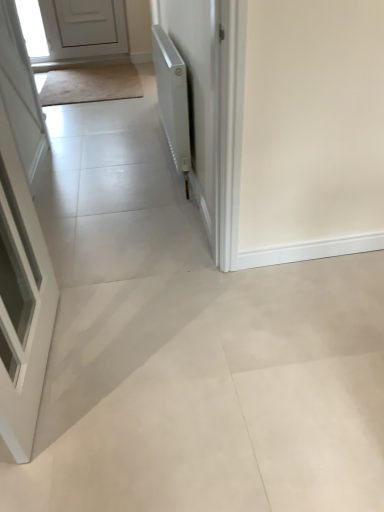
Question: Is white matte radiator at upper right taller than white matte door at upper left, the first door from the left?

Choices:
 (A) no
 (B) yes

Answer: (B)

Question: Is white matte radiator at upper right looking in the opposite direction of white matte door at upper left, arranged as the second door when viewed from the front?

Choices:
 (A) yes
 (B) no

Answer: (B)

Question: Is white matte radiator at upper right not within white matte door at upper left, the first door from the left?

Choices:
 (A) no
 (B) yes

Answer: (B)

Question: Is white matte radiator at upper right at the right side of white matte door at upper left, which is the 2th door from bottom to top?

Choices:
 (A) no
 (B) yes

Answer: (B)

Question: Is white matte radiator at upper right in contact with white matte door at upper left, arranged as the second door when viewed from the front?

Choices:
 (A) no
 (B) yes

Answer: (A)

Question: From the image's perspective, relative to white matte radiator at upper right, is white glossy door at left, which appears as the 2th door when viewed from the back, above or below?

Choices:
 (A) above
 (B) below

Answer: (B)

Question: In the image, is white glossy door at left, placed as the 2th door when sorted from left to right, positioned in front of or behind white matte radiator at upper right?

Choices:
 (A) behind
 (B) front

Answer: (B)

Question: Is white glossy door at left, the first door positioned from the right, wider or thinner than white matte radiator at upper right?

Choices:
 (A) wide
 (B) thin

Answer: (A)

Question: Which is correct: white glossy door at left, the first door positioned from the right, is inside white matte radiator at upper right, or outside of it?

Choices:
 (A) outside
 (B) inside

Answer: (A)

Question: From the image's perspective, is white matte door at upper left, arranged as the second door when viewed from the front, positioned above or below white matte radiator at upper right?

Choices:
 (A) below
 (B) above

Answer: (B)

Question: Considering the positions of white matte door at upper left, placed as the first door when sorted from back to front, and white matte radiator at upper right in the image, is white matte door at upper left, placed as the first door when sorted from back to front, taller or shorter than white matte radiator at upper right?

Choices:
 (A) short
 (B) tall

Answer: (A)

Question: Do you think white matte door at upper left, which appears as the second door when viewed from the right, is within white matte radiator at upper right, or outside of it?

Choices:
 (A) inside
 (B) outside

Answer: (B)

Question: In terms of size, does white matte door at upper left, acting as the first door starting from the top, appear bigger or smaller than white matte radiator at upper right?

Choices:
 (A) big
 (B) small

Answer: (B)

Question: Considering the relative positions of beige carpet at upper left and white matte radiator at upper right in the image provided, is beige carpet at upper left to the left or to the right of white matte radiator at upper right?

Choices:
 (A) right
 (B) left

Answer: (B)

Question: Is point (79, 81) positioned closer to the camera than point (178, 88)?

Choices:
 (A) closer
 (B) farther

Answer: (B)